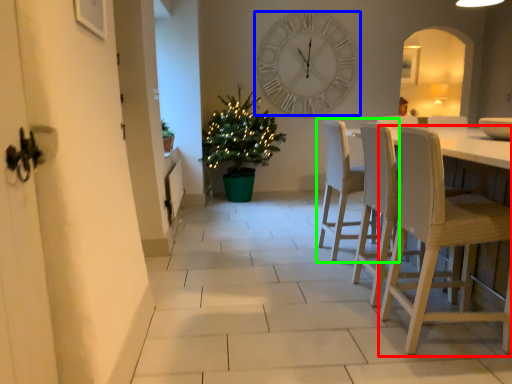
Question: Which is nearer to the chair (highlighted by a red box)? wall clock (highlighted by a blue box) or chair (highlighted by a green box).

Choices:
 (A) wall clock
 (B) chair

Answer: (B)